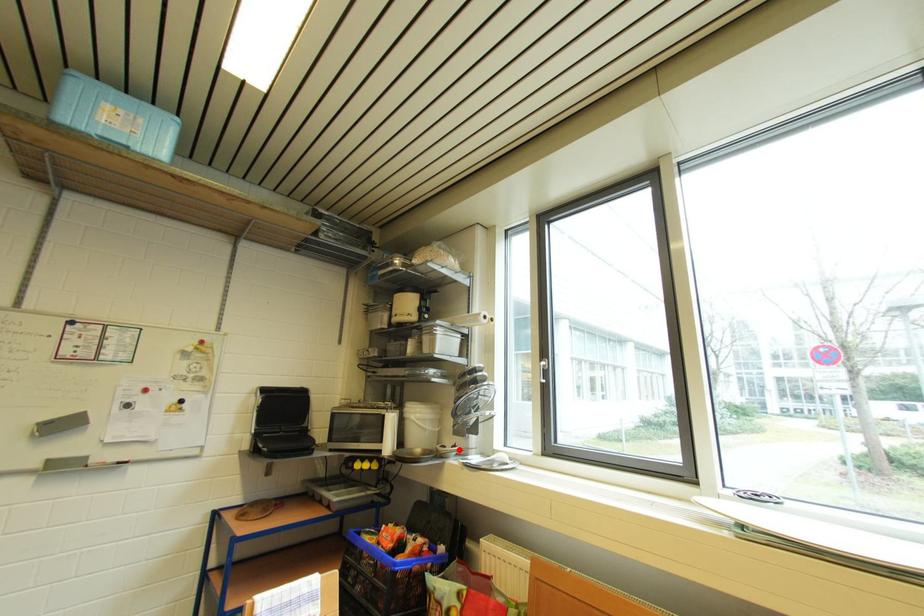
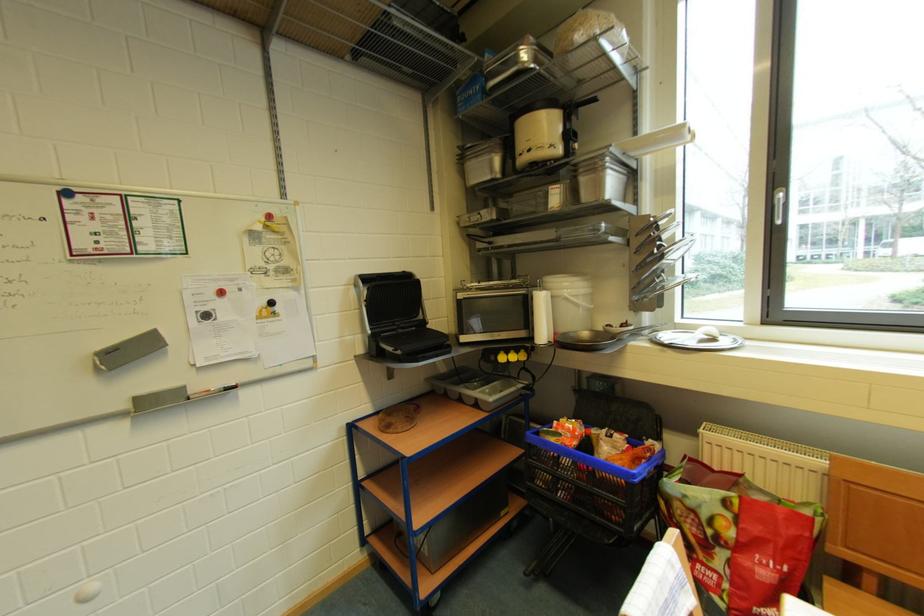
Where in the second image is the point corresponding to the highlighted location from the first image?

(629, 329)